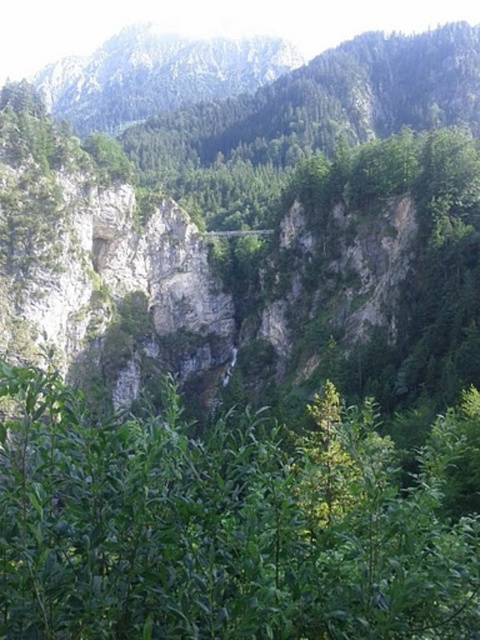
Between green leafy tree at center and rocky mountain at upper center, which one appears on the right side from the viewer's perspective?

green leafy tree at center is more to the right.

Is point (458, 595) farther from camera compared to point (289, 45)?

No, (458, 595) is closer to viewer.

At what (x,y) coordinates should I click in order to perform the action: click on green leafy tree at center. Please return your answer as a coordinate pair (x, y). Looking at the image, I should click on (219, 525).